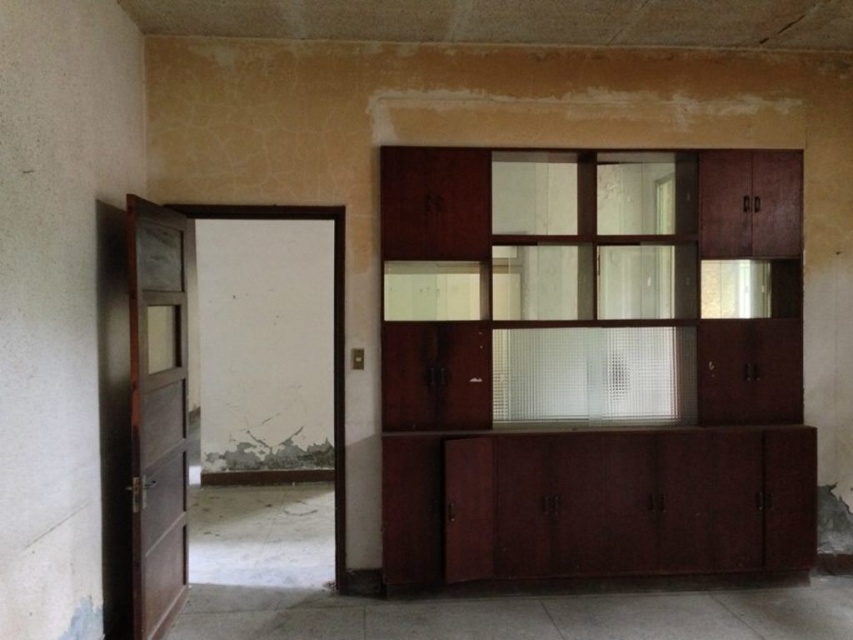
Question: Among these points, which one is farthest from the camera?

Choices:
 (A) (177, 483)
 (B) (746, 404)

Answer: (B)

Question: Does mahogany wood cabinet at right appear on the left side of brown wooden door at left?

Choices:
 (A) yes
 (B) no

Answer: (B)

Question: From the image, what is the correct spatial relationship of mahogany wood cabinet at right in relation to brown wooden door at left?

Choices:
 (A) right
 (B) left

Answer: (A)

Question: Which point is closer to the camera?

Choices:
 (A) (579, 378)
 (B) (137, 368)

Answer: (B)

Question: Is mahogany wood cabinet at right to the right of brown wooden door at left from the viewer's perspective?

Choices:
 (A) yes
 (B) no

Answer: (A)